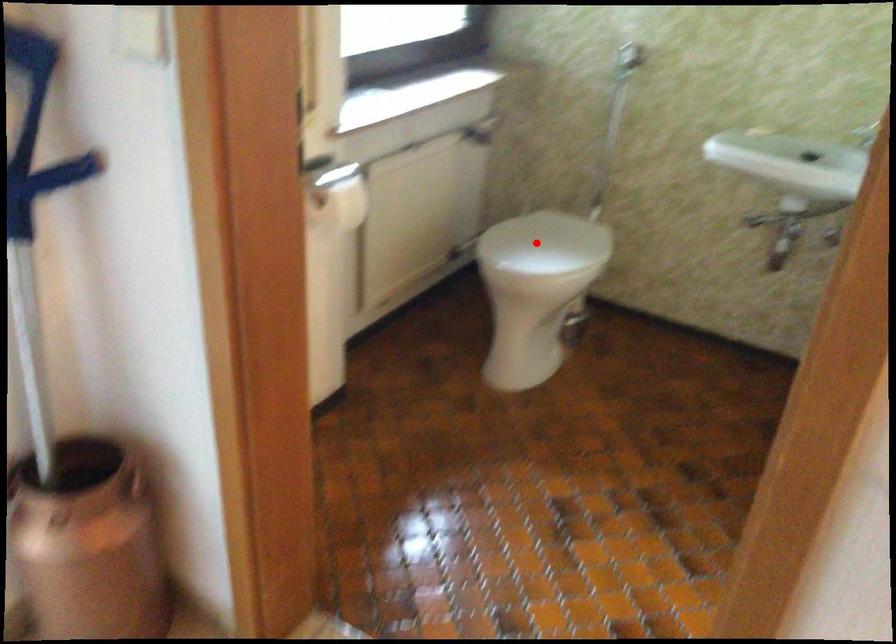
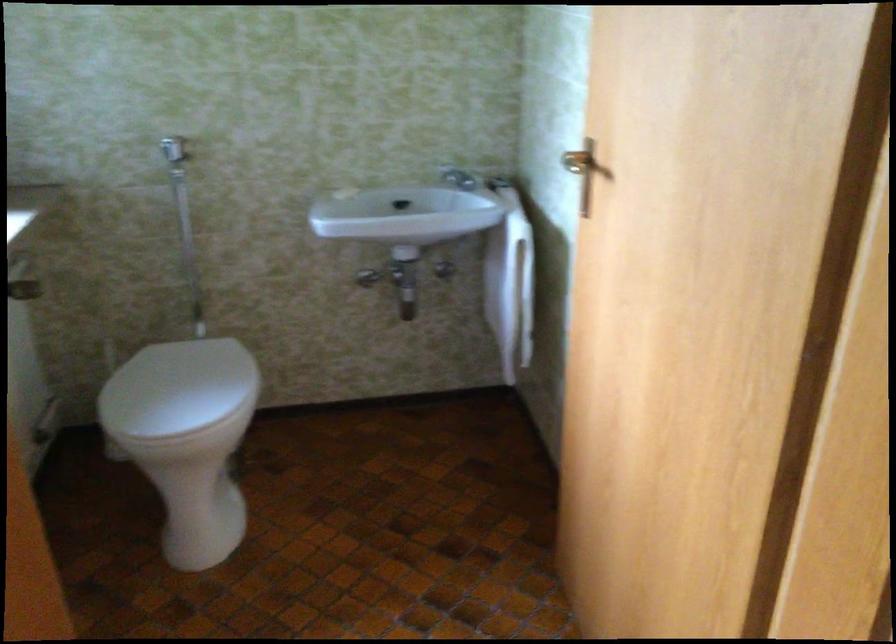
Question: I am providing you with two images of the same scene from different viewpoints. A red point is shown in image1. For the corresponding object point in image2, is it positioned nearer or farther from the camera?

Choices:
 (A) Nearer
 (B) Farther

Answer: (A)